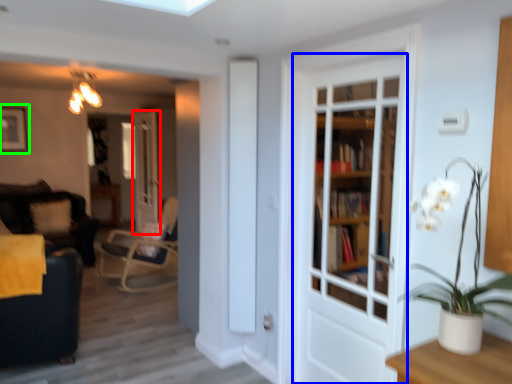
Question: Which object is the closest to the door (highlighted by a red box)? Choose among these: door (highlighted by a blue box) or picture frame (highlighted by a green box).

Choices:
 (A) door
 (B) picture frame

Answer: (B)